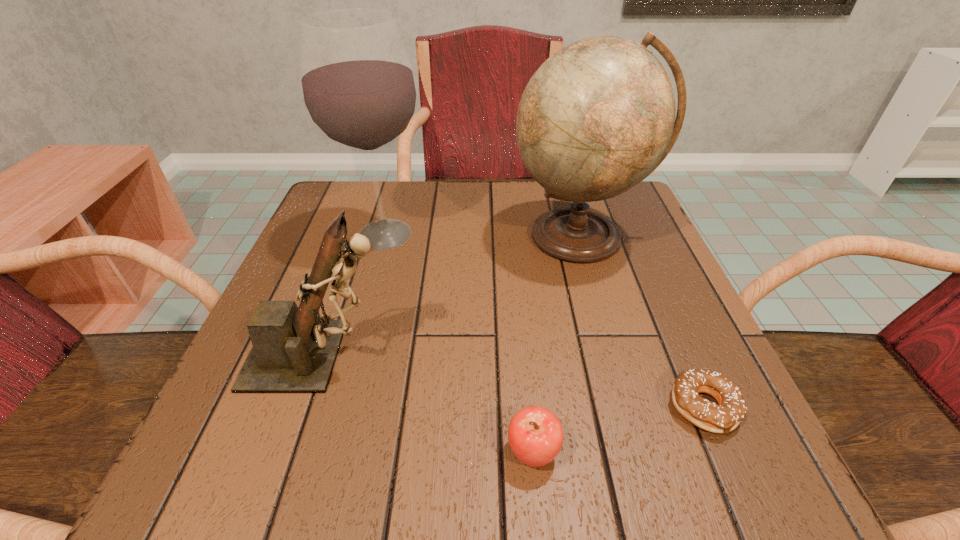
What are the coordinates of `free point that satisfies the following two spatial constraints: 1. on the front-facing side of the shortest object; 2. on the right side of the globe` in the screenshot? It's located at click(x=629, y=408).

What are the coordinates of `free space that satisfies the following two spatial constraints: 1. on the front-facing side of the shortest object; 2. on the right side of the third shortest object` in the screenshot? It's located at (303, 408).

The width and height of the screenshot is (960, 540). I want to click on free spot that satisfies the following two spatial constraints: 1. on the front-facing side of the apple; 2. on the left side of the figurine, so click(x=288, y=453).

Find the location of a particular element. The height and width of the screenshot is (540, 960). vacant position in the image that satisfies the following two spatial constraints: 1. on the back side of the apple; 2. on the front-facing side of the third tallest object is located at coordinates (523, 355).

Identify the location of free spot that satisfies the following two spatial constraints: 1. on the front-facing side of the figurine; 2. on the left side of the shortest object. This screenshot has width=960, height=540. (303, 408).

Locate an element on the screen. vacant space that satisfies the following two spatial constraints: 1. on the back side of the shortest object; 2. on the front-facing side of the figurine is located at coordinates (681, 355).

Find the location of a particular element. The image size is (960, 540). vacant space that satisfies the following two spatial constraints: 1. on the front-facing side of the shortest object; 2. on the right side of the globe is located at coordinates (629, 408).